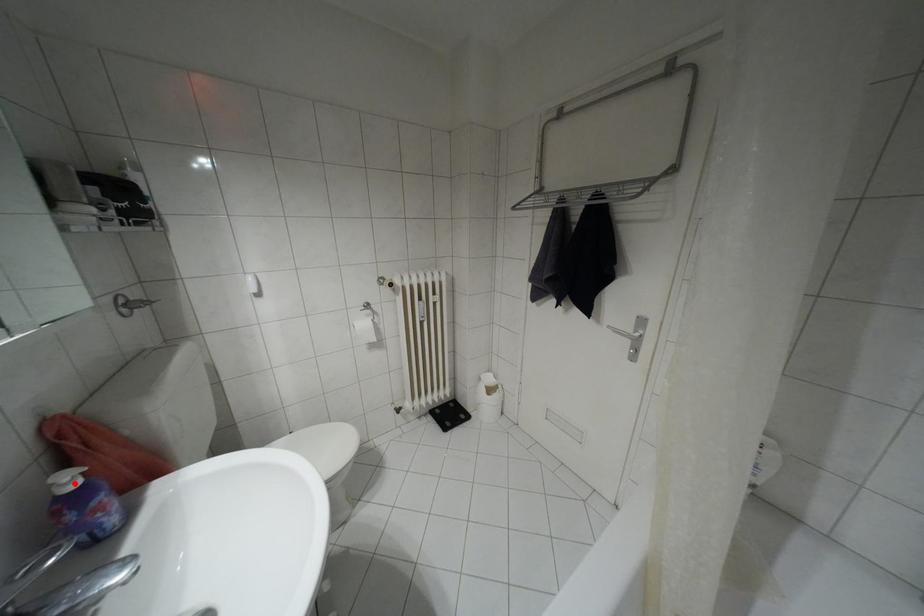
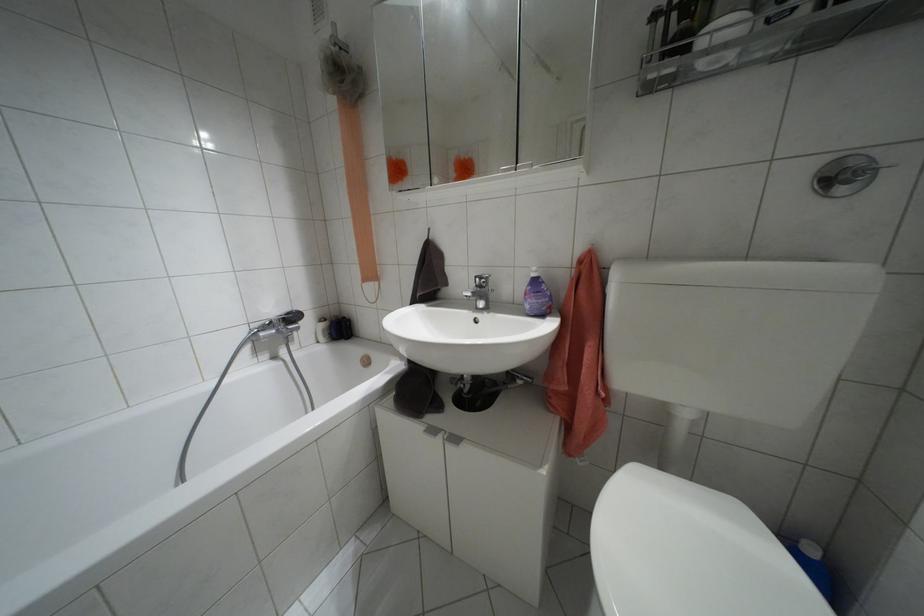
Locate, in the second image, the point that corresponds to the highlighted location in the first image.

(532, 274)